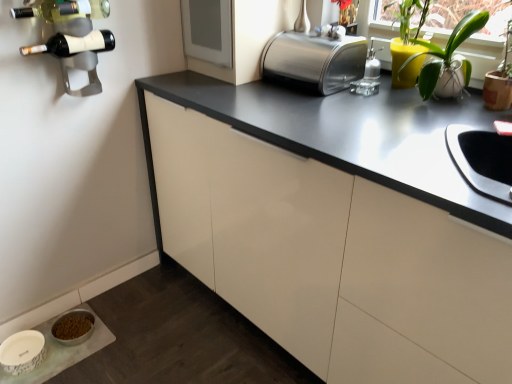
Question: Is metallic wine rack at upper left at the right side of matte black wine bottle at upper left, arranged as the 1th wine bottle when ordered from the bottom?

Choices:
 (A) no
 (B) yes

Answer: (B)

Question: Considering the relative sizes of metallic wine rack at upper left and matte black wine bottle at upper left, positioned as the 2th wine bottle in top-to-bottom order, in the image provided, is metallic wine rack at upper left wider than matte black wine bottle at upper left, positioned as the 2th wine bottle in top-to-bottom order,?

Choices:
 (A) no
 (B) yes

Answer: (A)

Question: Is metallic wine rack at upper left positioned with its back to matte black wine bottle at upper left, positioned as the 2th wine bottle in top-to-bottom order?

Choices:
 (A) no
 (B) yes

Answer: (B)

Question: Is metallic wine rack at upper left thinner than matte black wine bottle at upper left, positioned as the 2th wine bottle in top-to-bottom order?

Choices:
 (A) yes
 (B) no

Answer: (A)

Question: From the image's perspective, would you say metallic wine rack at upper left is shown under matte black wine bottle at upper left, arranged as the 1th wine bottle when ordered from the bottom?

Choices:
 (A) yes
 (B) no

Answer: (A)

Question: In the image, is green glass wine bottle at upper left, acting as the 1th wine bottle starting from the top, on the left side or the right side of matte black wine bottle at upper left, positioned as the 2th wine bottle in top-to-bottom order?

Choices:
 (A) right
 (B) left

Answer: (A)

Question: Does point (46, 16) appear closer or farther from the camera than point (35, 51)?

Choices:
 (A) closer
 (B) farther

Answer: (B)

Question: From the image's perspective, is green glass wine bottle at upper left, the second wine bottle in the bottom-to-top sequence, positioned above or below matte black wine bottle at upper left, positioned as the 2th wine bottle in top-to-bottom order?

Choices:
 (A) below
 (B) above

Answer: (B)

Question: From their relative heights in the image, would you say green glass wine bottle at upper left, the second wine bottle in the bottom-to-top sequence, is taller or shorter than matte black wine bottle at upper left, positioned as the 2th wine bottle in top-to-bottom order?

Choices:
 (A) short
 (B) tall

Answer: (B)

Question: Relative to polished stainless steel toaster at upper center, is green glass wine bottle at upper left, acting as the 1th wine bottle starting from the top, in front or behind?

Choices:
 (A) front
 (B) behind

Answer: (A)

Question: Based on their positions, is green glass wine bottle at upper left, the second wine bottle in the bottom-to-top sequence, located to the left or right of polished stainless steel toaster at upper center?

Choices:
 (A) right
 (B) left

Answer: (B)

Question: Does point (109, 4) appear closer or farther from the camera than point (320, 69)?

Choices:
 (A) farther
 (B) closer

Answer: (B)

Question: Considering the positions of green glass wine bottle at upper left, the second wine bottle in the bottom-to-top sequence, and polished stainless steel toaster at upper center in the image, is green glass wine bottle at upper left, the second wine bottle in the bottom-to-top sequence, taller or shorter than polished stainless steel toaster at upper center?

Choices:
 (A) tall
 (B) short

Answer: (B)

Question: Is white glossy pet food bowl at lower left bigger or smaller than matte white cabinet at center?

Choices:
 (A) small
 (B) big

Answer: (A)

Question: Is point (82, 354) positioned closer to the camera than point (459, 286)?

Choices:
 (A) farther
 (B) closer

Answer: (A)